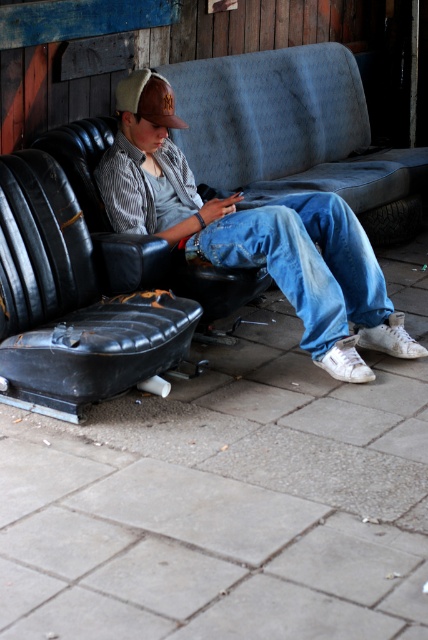
Which of these two, gray concrete pavement at lower center or brown leather baseball cap at upper center, stands taller?

gray concrete pavement at lower center

Consider the image. Can you confirm if gray concrete pavement at lower center is positioned below brown leather baseball cap at upper center?

Correct, gray concrete pavement at lower center is located below brown leather baseball cap at upper center.

Measure the distance between point [407,413] and camera.

They are 3.73 meters apart.

Where is `gray concrete pavement at lower center`? gray concrete pavement at lower center is located at coordinates (223, 502).

Who is more distant from viewer, (353, 257) or (380, 216)?

The point (380, 216) is more distant.

In order to click on denim jeans at center in this screenshot , I will do `click(261, 244)`.

Identify the location of gray concrete pavement at lower center. [x=223, y=502].

Is the position of gray concrete pavement at lower center more distant than that of blue denim jeans at center?

No, it is not.

Which is behind, point (204, 515) or point (324, 216)?

Point (324, 216)

Locate an element on the screen. gray concrete pavement at lower center is located at coordinates (223, 502).